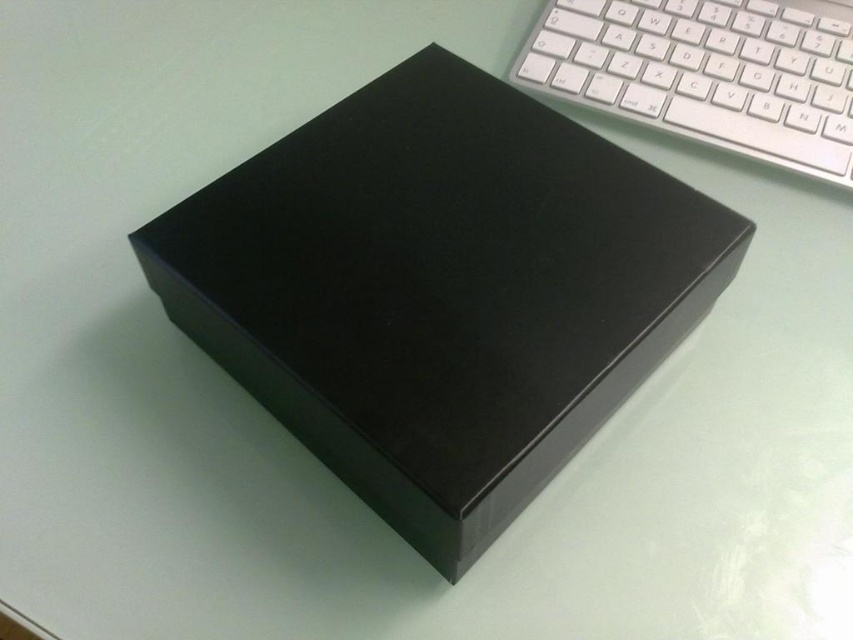
Question: Is matte black box at center positioned behind white plastic keyboard at upper right?

Choices:
 (A) yes
 (B) no

Answer: (B)

Question: Which object is closer to the camera taking this photo?

Choices:
 (A) white plastic keyboard at upper right
 (B) matte black box at center

Answer: (B)

Question: Is matte black box at center smaller than white plastic keyboard at upper right?

Choices:
 (A) yes
 (B) no

Answer: (B)

Question: Is matte black box at center thinner than white plastic keyboard at upper right?

Choices:
 (A) no
 (B) yes

Answer: (A)

Question: Which object appears farthest from the camera in this image?

Choices:
 (A) matte black box at center
 (B) white plastic keyboard at upper right

Answer: (B)